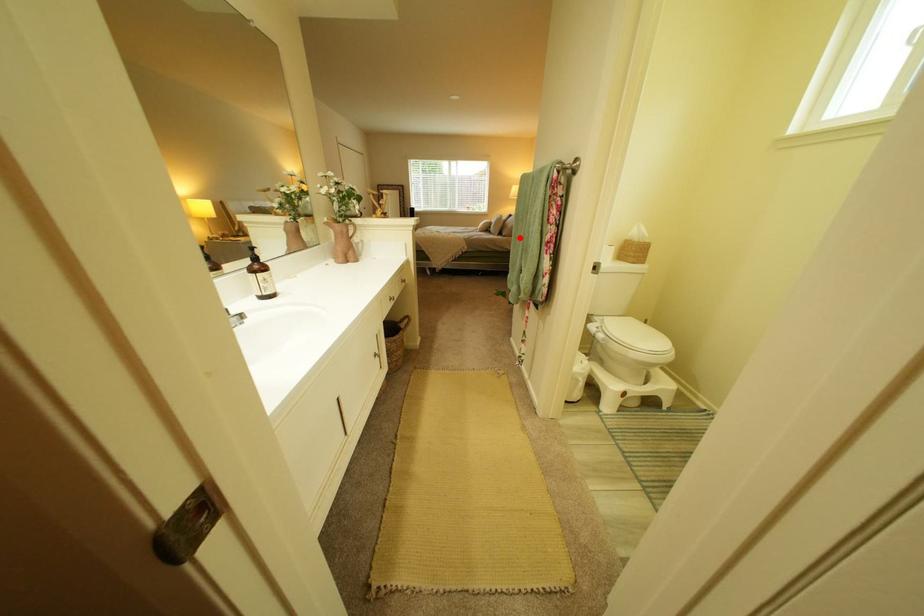
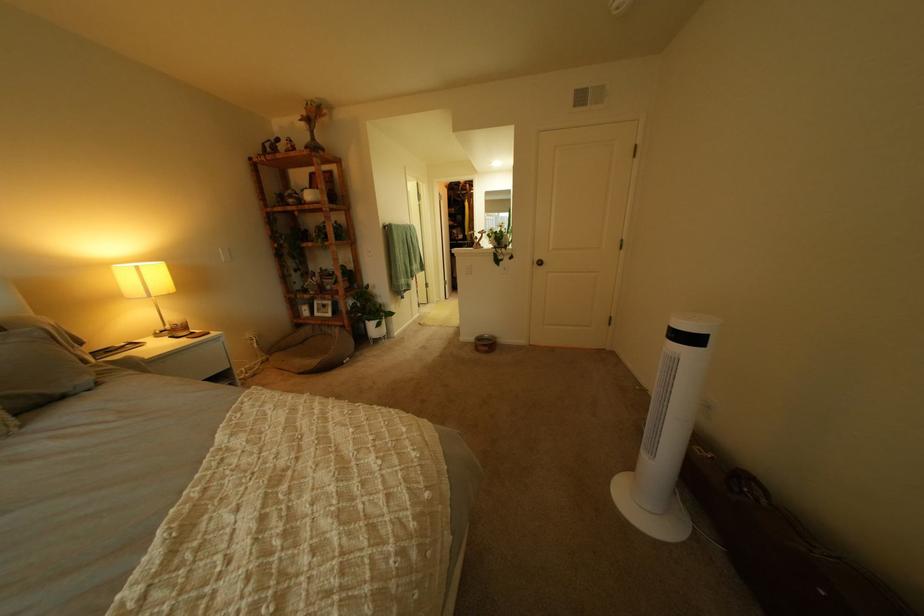
Find the pixel in the second image that matches the highlighted location in the first image.

(115, 385)